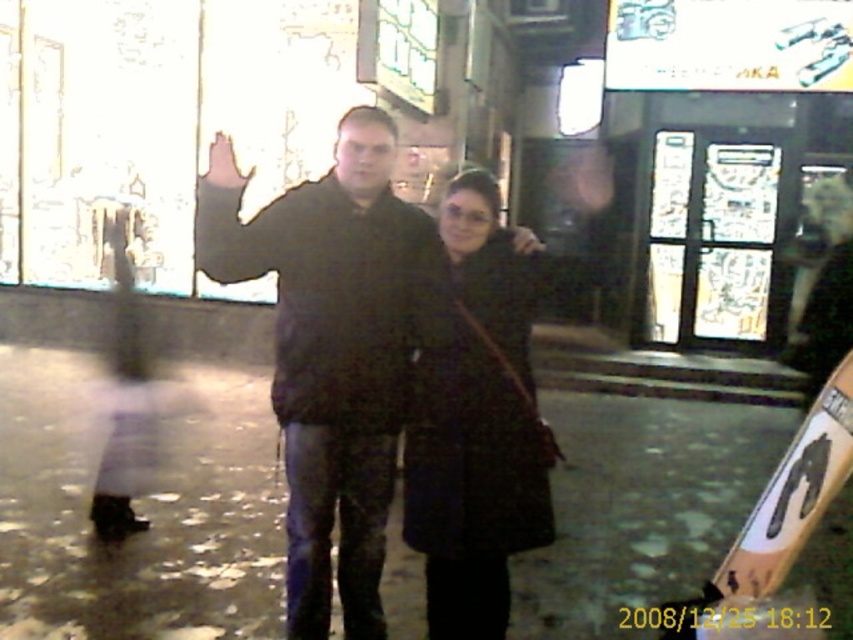
Can you confirm if dark matte coat at center is positioned below dark brown textured coat at center?

No, dark matte coat at center is not below dark brown textured coat at center.

Is dark matte coat at center wider than dark brown textured coat at center?

Yes, dark matte coat at center is wider than dark brown textured coat at center.

Between point (341, 528) and point (438, 465), which one is positioned in front?

Point (438, 465) is more forward.

Identify the location of dark matte coat at center. (332, 349).